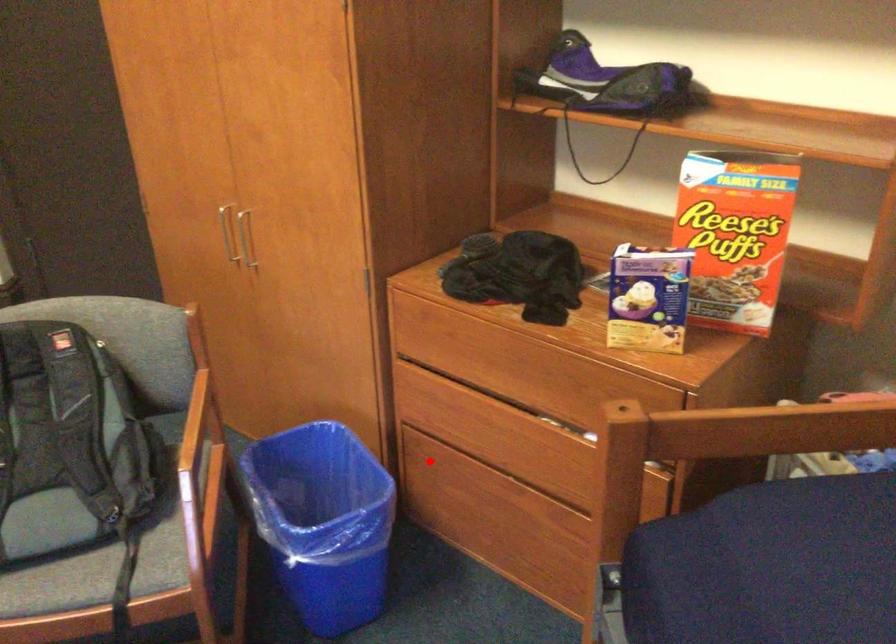
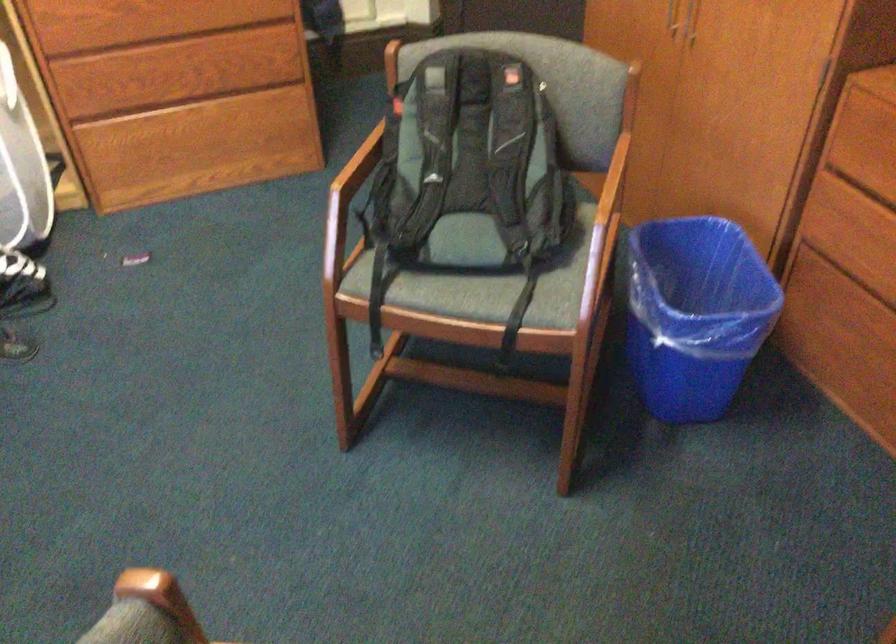
Question: I am providing you with two images of the same scene from different viewpoints. Image1 has a red point marked. In image2, the corresponding 3D location appears at what relative position? Reply with the corresponding letter.

Choices:
 (A) Closer
 (B) Farther

Answer: (A)